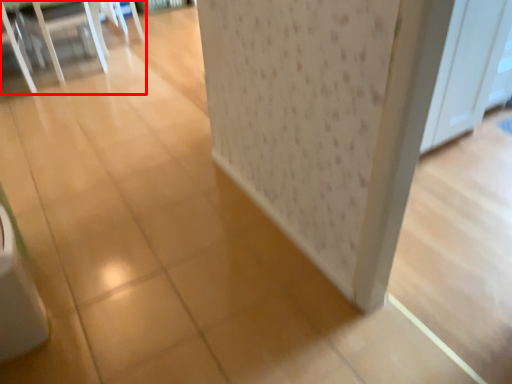
Question: Observing the image, what is the correct spatial positioning of furniture (annotated by the red box) in reference to screen door?

Choices:
 (A) left
 (B) right

Answer: (A)